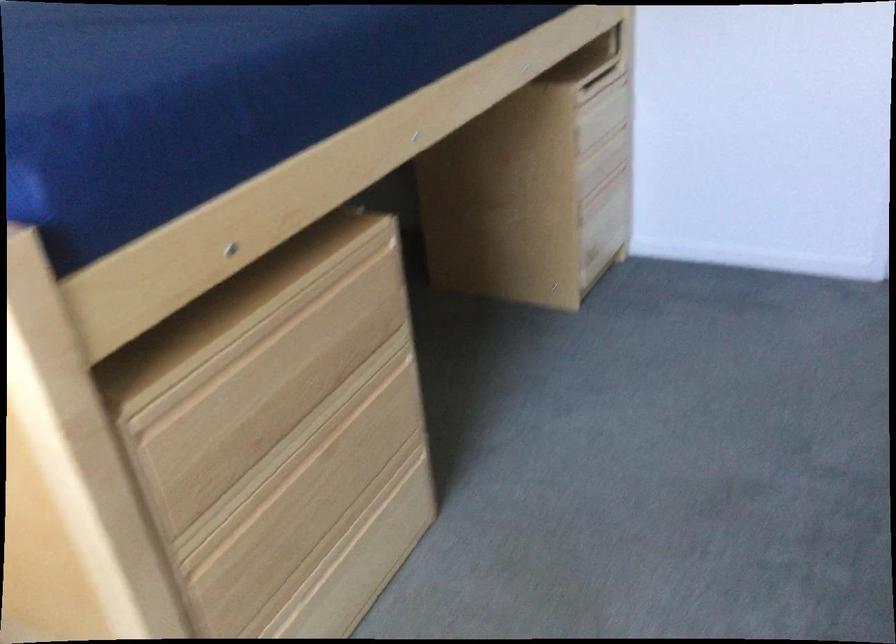
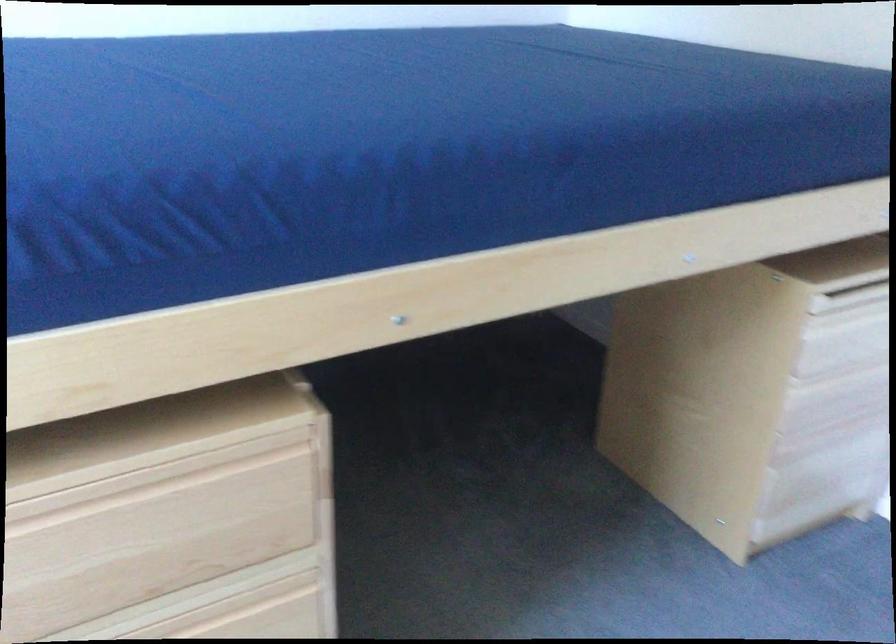
Locate, in the second image, the point that corresponds to the point at 601,151 in the first image.

(845, 381)